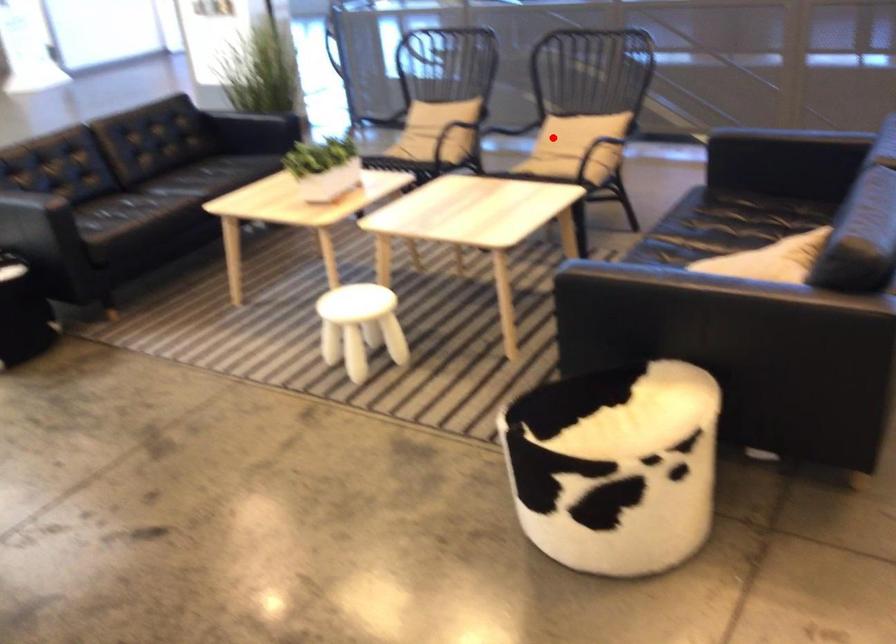
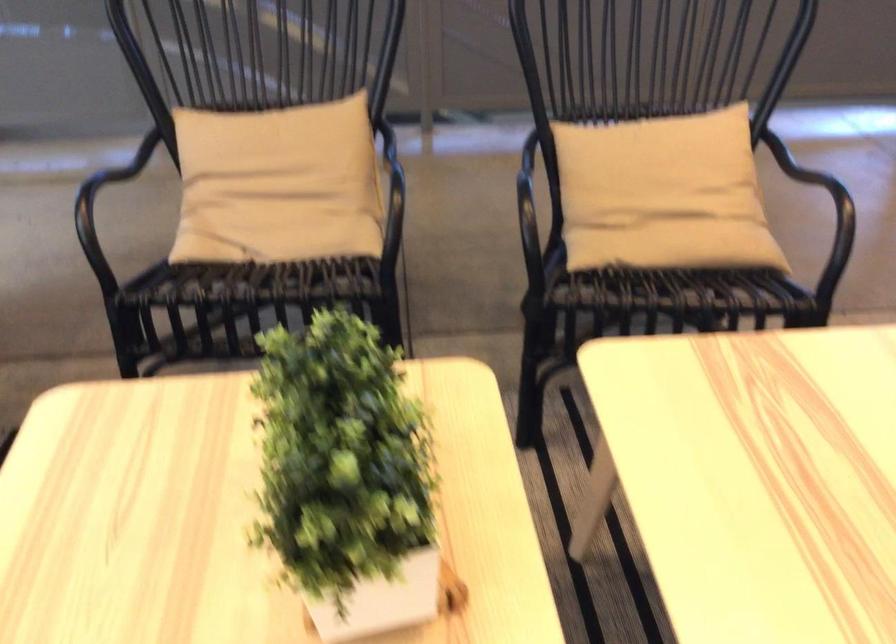
Question: I am providing you with two images of the same scene from different viewpoints. A red point is marked on the first image. Can you still see the location of the red point in image 2?

Choices:
 (A) Yes
 (B) No

Answer: (A)